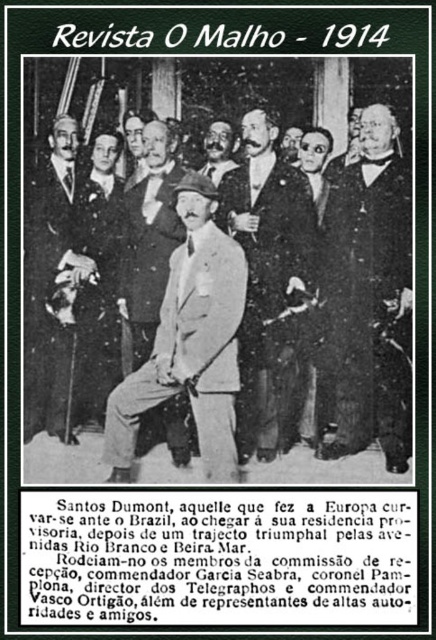
Who is more forward, [91,285] or [153,179]?

Point [153,179]

Consider the image. Is smooth gray suit at center further to the viewer compared to light brown leather coat at center?

That is True.

Image resolution: width=436 pixels, height=640 pixels. Describe the element at coordinates (96, 282) in the screenshot. I see `smooth gray suit at center` at that location.

Where is `smooth gray suit at center`? smooth gray suit at center is located at coordinates (96, 282).

Does dark gray suit at right have a lesser height compared to dark gray suit at center?

Incorrect, dark gray suit at right's height does not fall short of dark gray suit at center's.

Who is higher up, dark gray suit at right or dark gray suit at center?

dark gray suit at center is above.

Where is `dark gray suit at right`? dark gray suit at right is located at coordinates (370, 296).

Identify the location of dark gray suit at right. (370, 296).

Is point (222, 342) more distant than point (29, 312)?

No, it is not.

The image size is (436, 640). In order to click on light gray suit at center in this screenshot , I will do `click(190, 342)`.

Is point (194, 264) less distant than point (47, 339)?

Yes.

At what (x,y) coordinates should I click in order to perform the action: click on light gray suit at center. Please return your answer as a coordinate pair (x, y). This screenshot has height=640, width=436. Looking at the image, I should click on (190, 342).